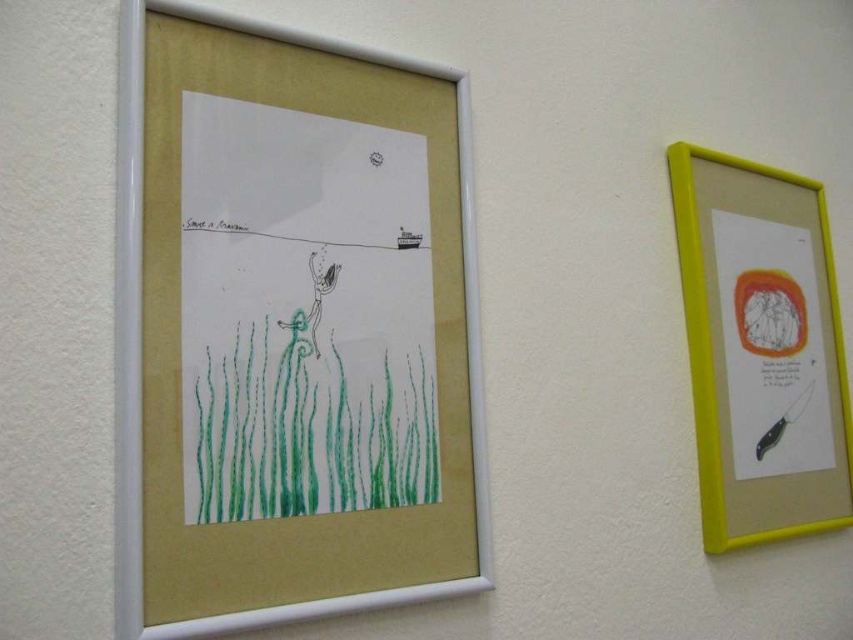
Between white matte picture frame at left and yellow plastic picture frame at right, which one appears on the right side from the viewer's perspective?

yellow plastic picture frame at right is more to the right.

Is white matte picture frame at left smaller than yellow plastic picture frame at right?

No, white matte picture frame at left is not smaller than yellow plastic picture frame at right.

Does point (155, 614) lie in front of point (724, 461)?

Yes, it is in front of point (724, 461).

The height and width of the screenshot is (640, 853). What are the coordinates of `white matte picture frame at left` in the screenshot? It's located at (289, 326).

Is yellow plastic picture frame at right above green crayon grass at lower left?

Correct, yellow plastic picture frame at right is located above green crayon grass at lower left.

Which is below, yellow plastic picture frame at right or green crayon grass at lower left?

green crayon grass at lower left

Is point (730, 400) positioned in front of point (314, 358)?

No, it is not.

Find the location of `yellow plastic picture frame at right`. yellow plastic picture frame at right is located at coordinates (761, 349).

Who is positioned more to the left, white matte picture frame at left or green crayon grass at lower left?

From the viewer's perspective, white matte picture frame at left appears more on the left side.

Is white matte picture frame at left above green crayon grass at lower left?

Correct, white matte picture frame at left is located above green crayon grass at lower left.

I want to click on white matte picture frame at left, so click(x=289, y=326).

Where is `white matte picture frame at left`? Image resolution: width=853 pixels, height=640 pixels. white matte picture frame at left is located at coordinates (289, 326).